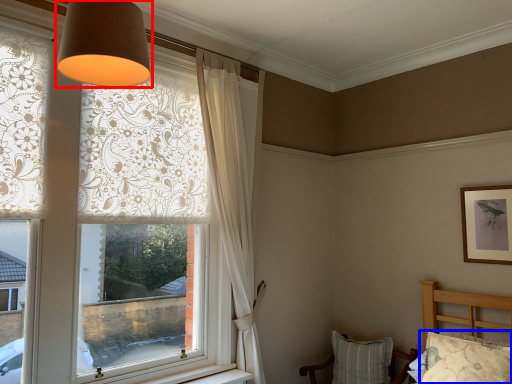
Question: Which of the following is the closest to the observer, lamp (highlighted by a red box) or pillow (highlighted by a blue box)?

Choices:
 (A) lamp
 (B) pillow

Answer: (A)